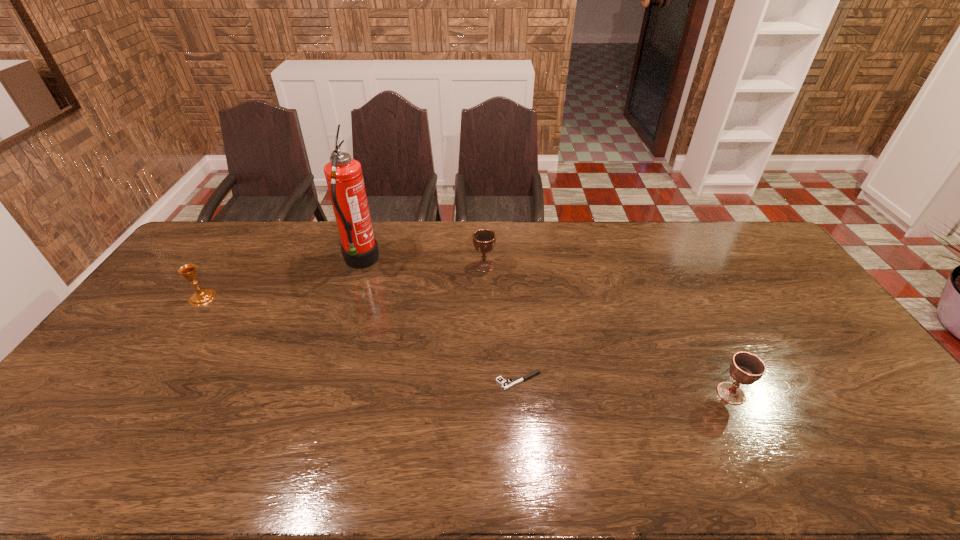
Where is `fire extinguisher`? This screenshot has width=960, height=540. fire extinguisher is located at coordinates (344, 177).

Identify the location of the fourth object from right to left. (344, 177).

Find the location of `the second chalice from left to right`. the second chalice from left to right is located at coordinates (484, 240).

Locate an element on the screen. the rightmost object is located at coordinates (746, 368).

The height and width of the screenshot is (540, 960). I want to click on the rightmost chalice, so click(x=746, y=368).

The width and height of the screenshot is (960, 540). Identify the location of the second farthest chalice. (202, 297).

At what (x,y) coordinates should I click in order to perform the action: click on the leftmost object. Please return your answer as a coordinate pair (x, y). The width and height of the screenshot is (960, 540). Looking at the image, I should click on (202, 297).

This screenshot has width=960, height=540. In order to click on the shortest object in this screenshot , I will do `click(504, 384)`.

I want to click on free space located on the front-facing side of the tallest object, so click(x=401, y=262).

The height and width of the screenshot is (540, 960). I want to click on free space located 0.180m on the front of the second chalice from left to right, so click(x=485, y=310).